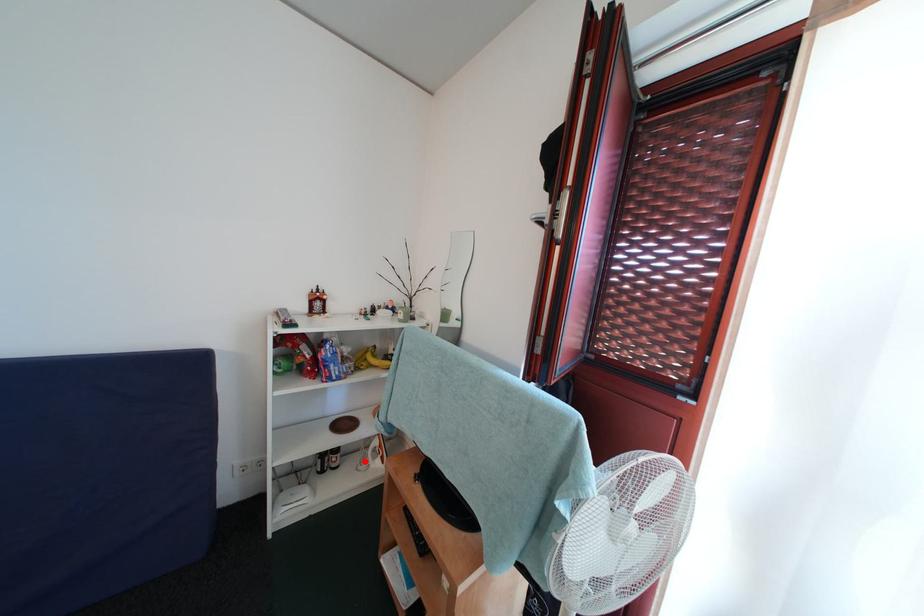
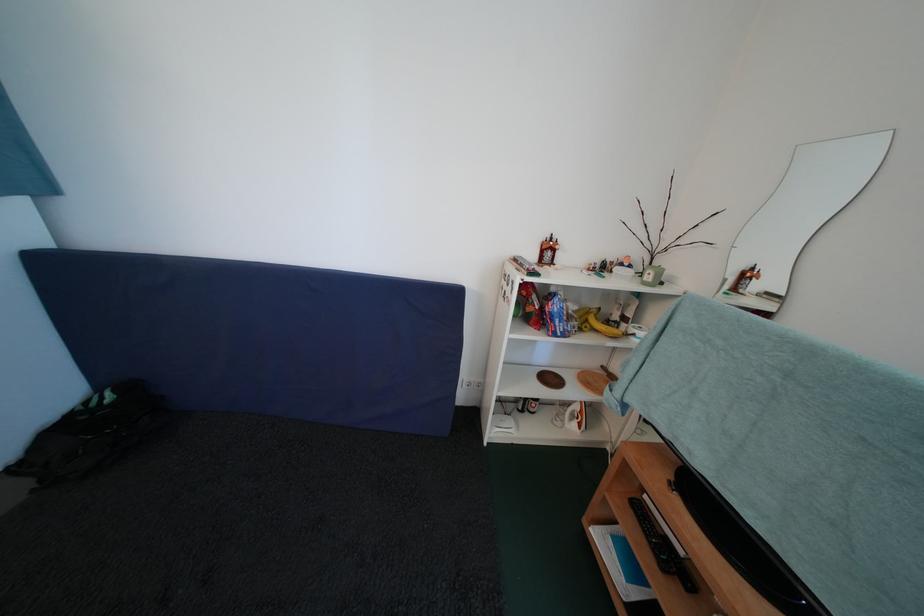
Question: I am providing you with two images of the same scene from different viewpoints. In image1, a red point is highlighted. Considering the same 3D point in image2, which of the following is correct?

Choices:
 (A) It is closer
 (B) It is farther

Answer: (A)